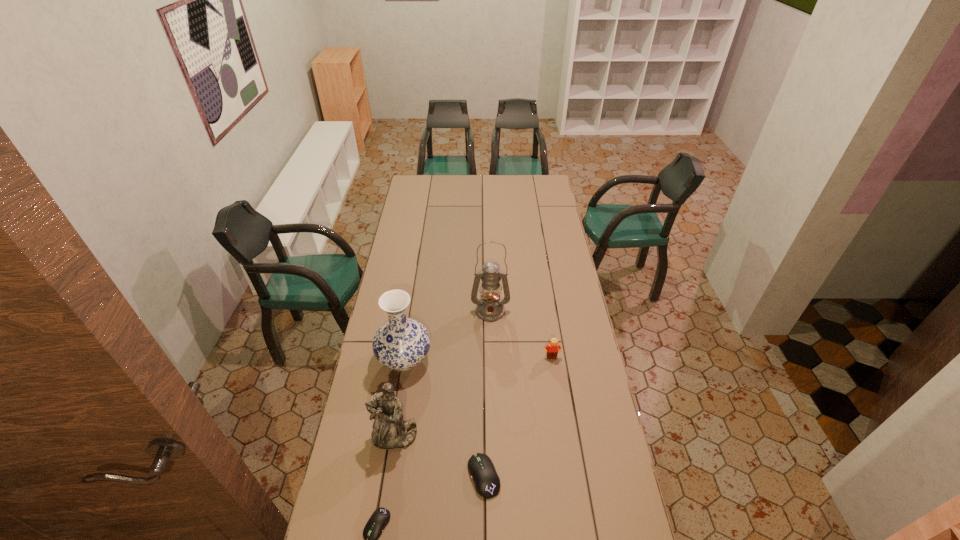
The image size is (960, 540). I want to click on vacant area situated on the back of the vase, so click(416, 291).

Locate an element on the screen. The width and height of the screenshot is (960, 540). free location located on the face of the Lego is located at coordinates (561, 418).

Find the location of a particular element. Image resolution: width=960 pixels, height=540 pixels. vacant space situated on the front-facing side of the third tallest object is located at coordinates (388, 477).

Find the location of a particular element. Image resolution: width=960 pixels, height=540 pixels. vase present at the left edge is located at coordinates (401, 343).

Locate an element on the screen. This screenshot has width=960, height=540. figurine situated at the left edge is located at coordinates (390, 431).

Where is `object at the right edge`? object at the right edge is located at coordinates (552, 350).

Where is `free space at the far edge`? free space at the far edge is located at coordinates (496, 174).

Locate an element on the screen. This screenshot has height=540, width=960. vacant space at the near edge of the desktop is located at coordinates (569, 520).

At what (x,y) coordinates should I click in order to perform the action: click on vacant space at the left edge of the desktop. Please return your answer as a coordinate pair (x, y). The image size is (960, 540). Looking at the image, I should click on (405, 238).

Locate an element on the screen. free space at the right edge of the desktop is located at coordinates (533, 206).